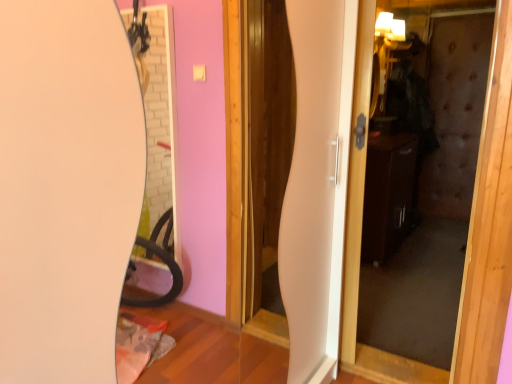
At what (x,y) coordinates should I click in order to perform the action: click on wooden door at center. Please return your answer as a coordinate pair (x, y). Image resolution: width=512 pixels, height=384 pixels. Looking at the image, I should click on (489, 225).

What do you see at coordinates (489, 225) in the screenshot? This screenshot has height=384, width=512. I see `wooden door at center` at bounding box center [489, 225].

Find the location of `wooden door at center`. wooden door at center is located at coordinates (489, 225).